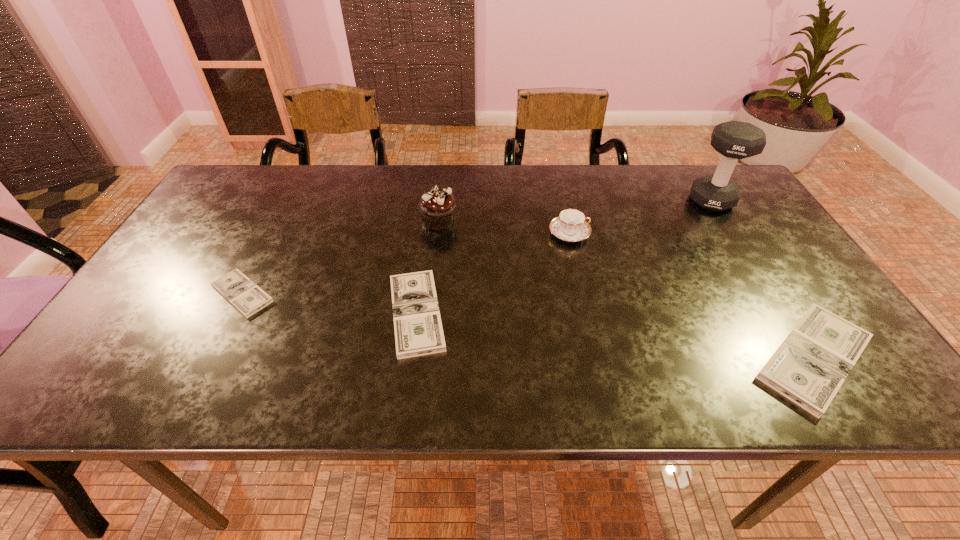
Find the location of a particular element. This screenshot has height=540, width=960. vacant space that satisfies the following two spatial constraints: 1. on the side with the handle of the third tallest object; 2. on the back side of the rightmost dollar is located at coordinates (597, 358).

Where is `free location that satisfies the following two spatial constraints: 1. on the side with the handle of the third tallest object; 2. on the left side of the rightmost dollar`? free location that satisfies the following two spatial constraints: 1. on the side with the handle of the third tallest object; 2. on the left side of the rightmost dollar is located at coordinates (597, 358).

Image resolution: width=960 pixels, height=540 pixels. I want to click on vacant space that satisfies the following two spatial constraints: 1. on the side with the handle of the teacup; 2. on the front side of the second dollar from left to right, so click(x=588, y=313).

Where is `free space that satisfies the following two spatial constraints: 1. on the side with the handle of the fourth object from left to right; 2. on the right side of the rightmost dollar`? The height and width of the screenshot is (540, 960). free space that satisfies the following two spatial constraints: 1. on the side with the handle of the fourth object from left to right; 2. on the right side of the rightmost dollar is located at coordinates (597, 358).

Locate an element on the screen. free space in the image that satisfies the following two spatial constraints: 1. on the back side of the dumbbell; 2. on the right side of the second tallest object is located at coordinates [x=441, y=200].